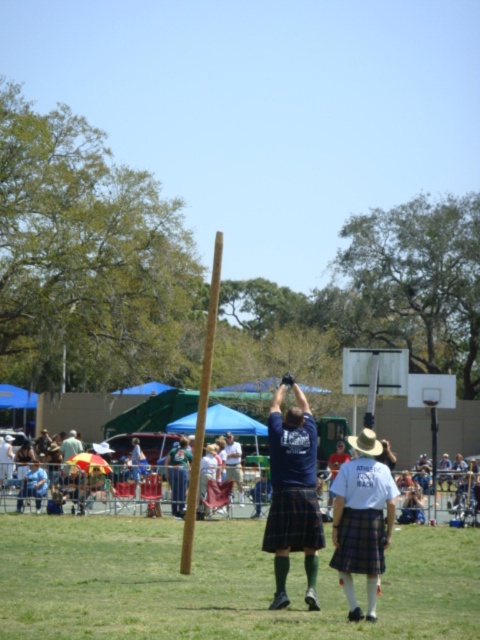
Does plaid kilt at center appear on the left side of black plaid kilt at center?

Correct, you'll find plaid kilt at center to the left of black plaid kilt at center.

Does plaid kilt at center appear on the right side of black plaid kilt at center?

In fact, plaid kilt at center is to the left of black plaid kilt at center.

Where is `plaid kilt at center`? plaid kilt at center is located at coordinates (292, 493).

You are a GUI agent. You are given a task and a screenshot of the screen. Output one action in this format:
    pyautogui.click(x=<x>, y=<y>)
    Task: Click on the plaid kilt at center
    
    Given the screenshot: What is the action you would take?
    pyautogui.click(x=292, y=493)

Can you confirm if plaid kilt at center is positioned to the left of red plaid kilt at center?

Correct, you'll find plaid kilt at center to the left of red plaid kilt at center.

Which of these two, plaid kilt at center or red plaid kilt at center, stands shorter?

With less height is red plaid kilt at center.

Is point (309, 516) farther from viewer compared to point (374, 552)?

That is True.

Where is `plaid kilt at center`? The width and height of the screenshot is (480, 640). plaid kilt at center is located at coordinates (292, 493).

Does plaid fabric kilt at center come in front of black plaid kilt at center?

Yes, plaid fabric kilt at center is in front of black plaid kilt at center.

Which is behind, point (368, 584) or point (316, 541)?

Point (316, 541)

Find the location of a particular element. Image resolution: width=480 pixels, height=640 pixels. plaid fabric kilt at center is located at coordinates (361, 518).